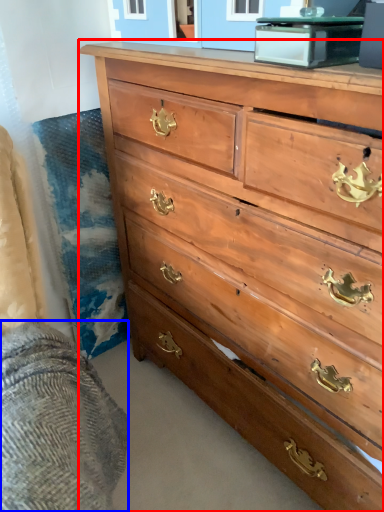
Question: Among these objects, which one is farthest to the camera, chest of drawers (highlighted by a red box) or bedding (highlighted by a blue box)?

Choices:
 (A) chest of drawers
 (B) bedding

Answer: (A)